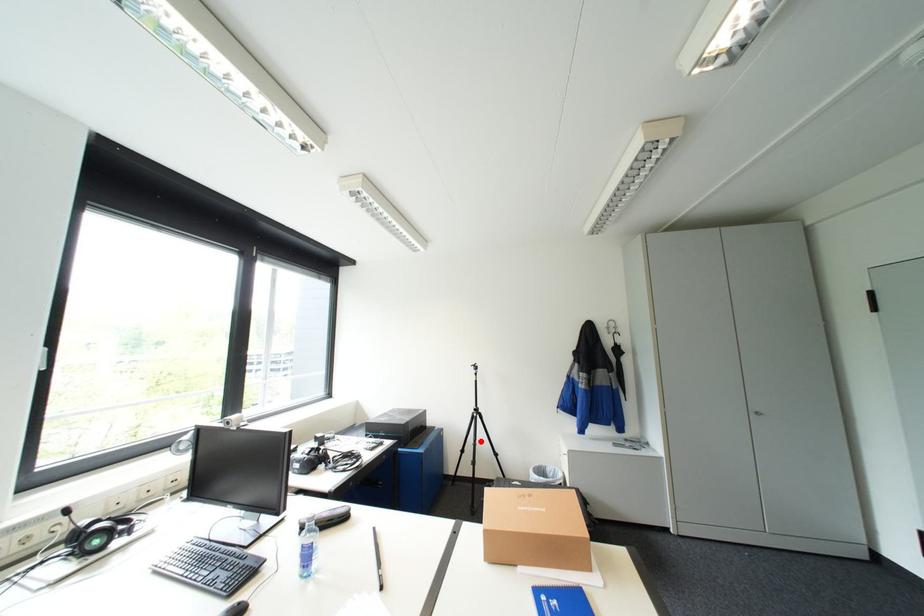
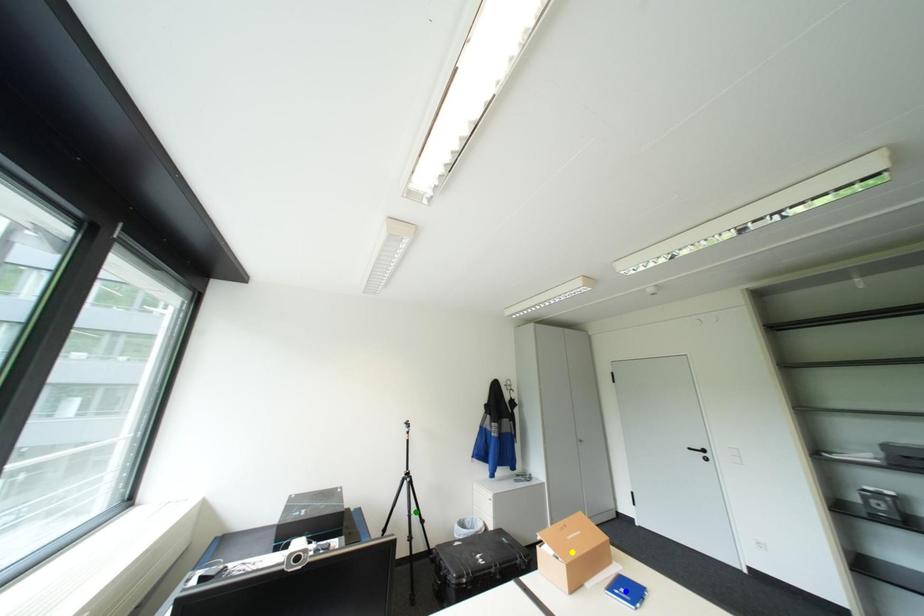
Question: I am providing you with two images of the same scene from different viewpoints. A red point is marked on the first image. You are given multiple points on the second image. Which point in image 2 represents the same 3d spot as the red point in image 1?

Choices:
 (A) blue point
 (B) green point
 (C) yellow point

Answer: (B)